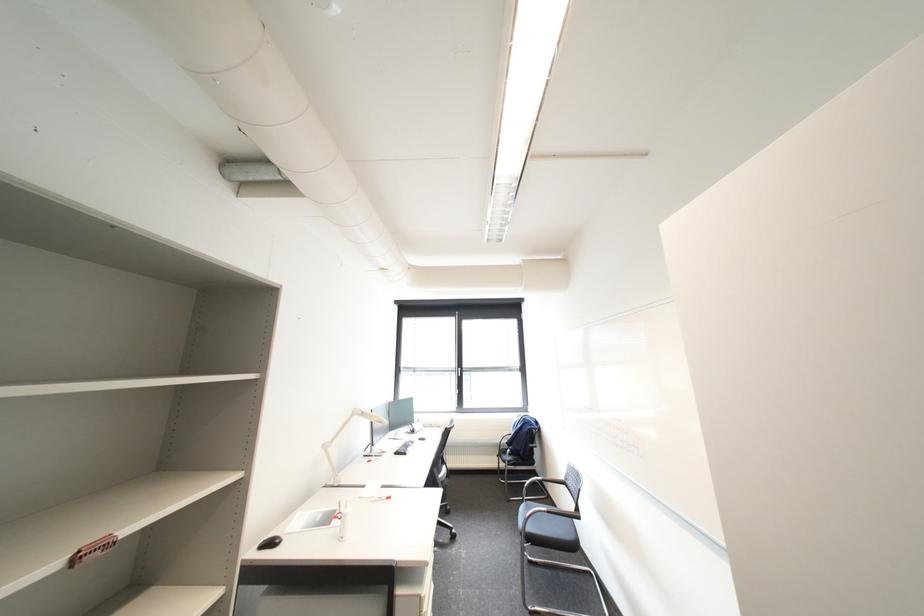
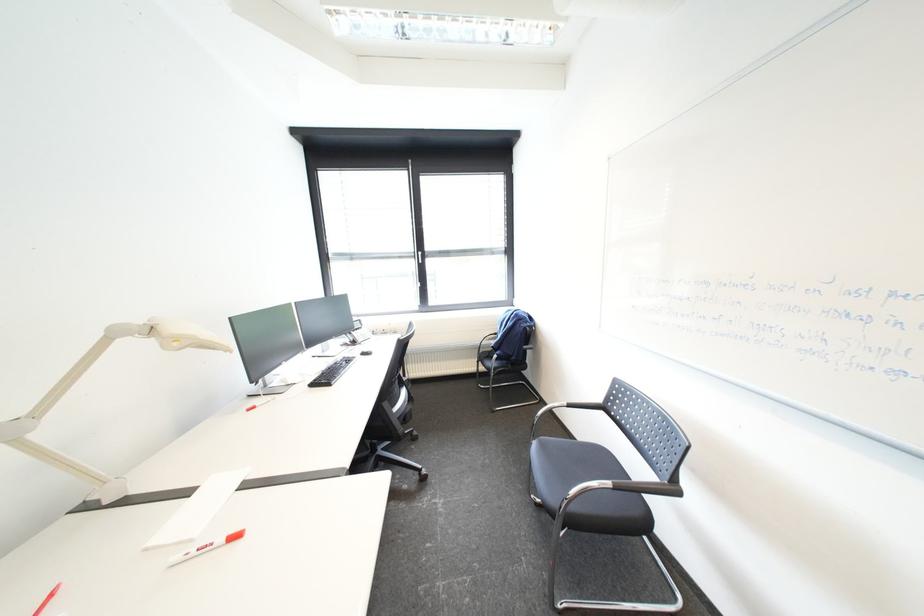
Question: In a continuous first-person perspective shot, in which direction is the camera moving?

Choices:
 (A) Left
 (B) Right
 (C) Forward
 (D) Backward

Answer: (C)